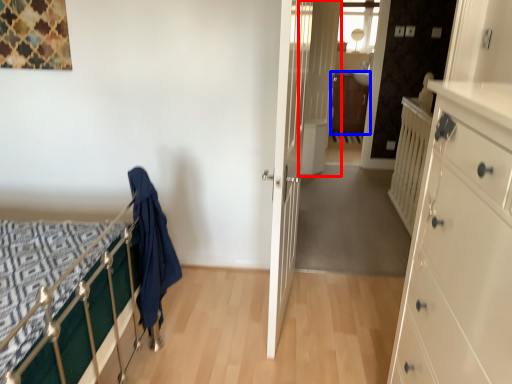
Question: Which object appears farthest to the camera in this image, door (highlighted by a red box) or file cabinet (highlighted by a blue box)?

Choices:
 (A) door
 (B) file cabinet

Answer: (B)